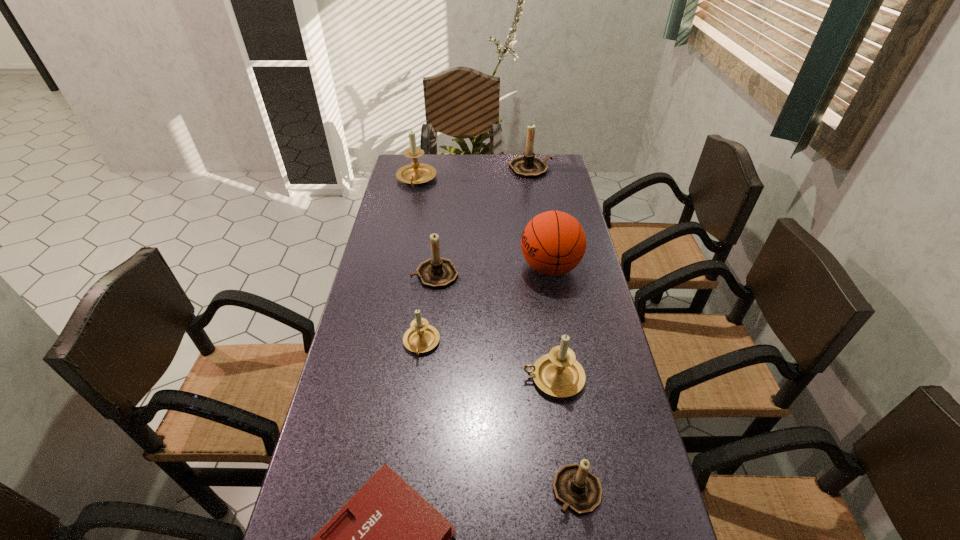
This screenshot has width=960, height=540. I want to click on empty space between the rightmost beige candle holder and the smallest beige candle holder, so click(x=488, y=361).

Where is `vacant space that's between the second biggest brown candle holder and the smallest beige candle holder`? vacant space that's between the second biggest brown candle holder and the smallest beige candle holder is located at coordinates (428, 309).

Image resolution: width=960 pixels, height=540 pixels. I want to click on object that stands as the third closest to the shortest object, so click(421, 337).

Choose which object is the fourth nearest neighbor to the red first-aid kit. Please provide its 2D coordinates. Your answer should be formatted as a tuple, i.e. [(x, y)], where the tuple contains the x and y coordinates of a point satisfying the conditions above.

[(437, 272)]

Identify which candle holder is the fifth nearest to the second smallest brown candle holder. Please provide its 2D coordinates. Your answer should be formatted as a tuple, i.e. [(x, y)], where the tuple contains the x and y coordinates of a point satisfying the conditions above.

[(577, 488)]

This screenshot has height=540, width=960. Identify the location of the fourth closest candle holder to the farthest brown candle holder. (559, 374).

Select which brown candle holder is the third closest to the shortest object. Please provide its 2D coordinates. Your answer should be formatted as a tuple, i.e. [(x, y)], where the tuple contains the x and y coordinates of a point satisfying the conditions above.

[(528, 166)]

Choose which brown candle holder is the third nearest neighbor to the biggest beige candle holder. Please provide its 2D coordinates. Your answer should be formatted as a tuple, i.e. [(x, y)], where the tuple contains the x and y coordinates of a point satisfying the conditions above.

[(577, 488)]

Identify the location of beige candle holder identified as the second closest to the second biggest beige candle holder. (415, 173).

Where is `beige candle holder that stands as the closest to the smallest beige candle holder`? This screenshot has width=960, height=540. beige candle holder that stands as the closest to the smallest beige candle holder is located at coordinates (559, 374).